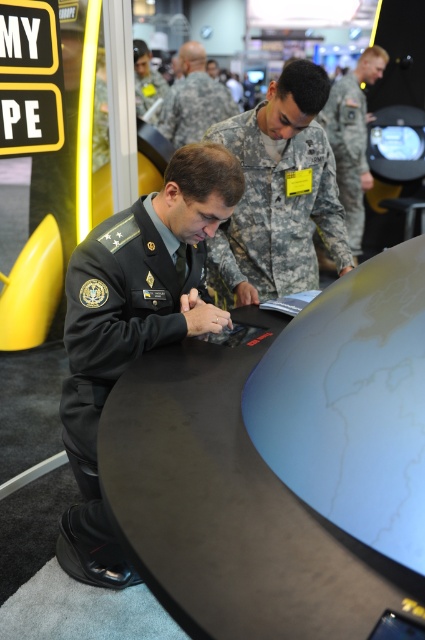
Can you confirm if camouflage fabric uniform at center is wider than matte black uniform at upper center?

Yes, camouflage fabric uniform at center is wider than matte black uniform at upper center.

Between point (343, 225) and point (152, 90), which one is positioned in front?

Point (343, 225) is in front.

Between point (289, 280) and point (144, 100), which one is positioned behind?

Point (144, 100)

In order to click on camouflage fabric uniform at center in this screenshot , I will do click(x=275, y=212).

From the picture: Is black matte table at center below camouflage fabric uniform at upper center?

Indeed, black matte table at center is positioned under camouflage fabric uniform at upper center.

Does point (158, 560) come behind point (331, 129)?

No, (158, 560) is closer to viewer.

Between point (421, 538) and point (359, 145), which one is positioned behind?

Positioned behind is point (359, 145).

The image size is (425, 640). I want to click on black matte table at center, so click(x=282, y=465).

Does camouflage fabric uniform at upper center have a lesser height compared to matte black uniform at upper center?

Incorrect, camouflage fabric uniform at upper center's height does not fall short of matte black uniform at upper center's.

Does point (354, 125) come behind point (158, 76)?

No, (354, 125) is closer to viewer.

Which is in front, point (340, 189) or point (149, 60)?

Positioned in front is point (340, 189).

The height and width of the screenshot is (640, 425). What are the coordinates of `camouflage fabric uniform at upper center` in the screenshot? It's located at (348, 150).